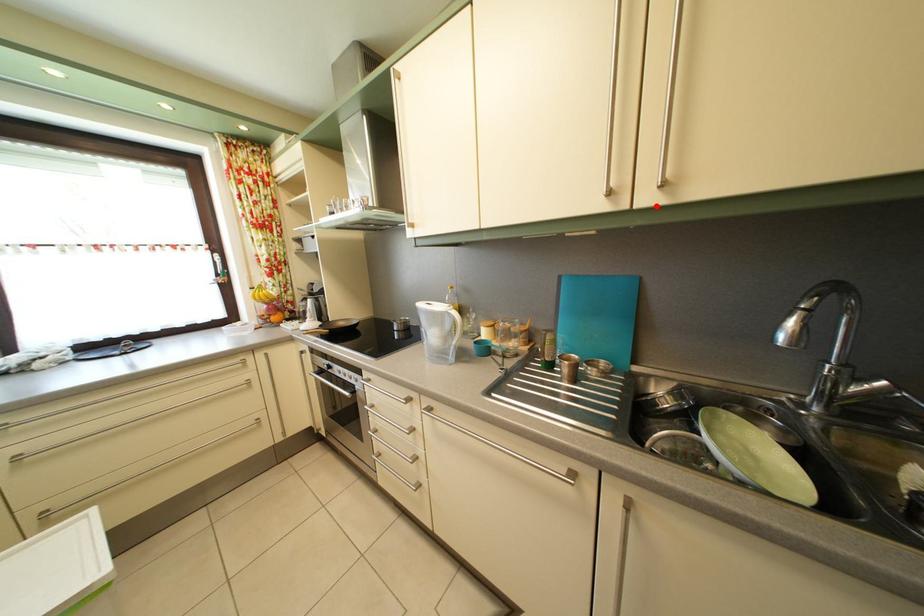
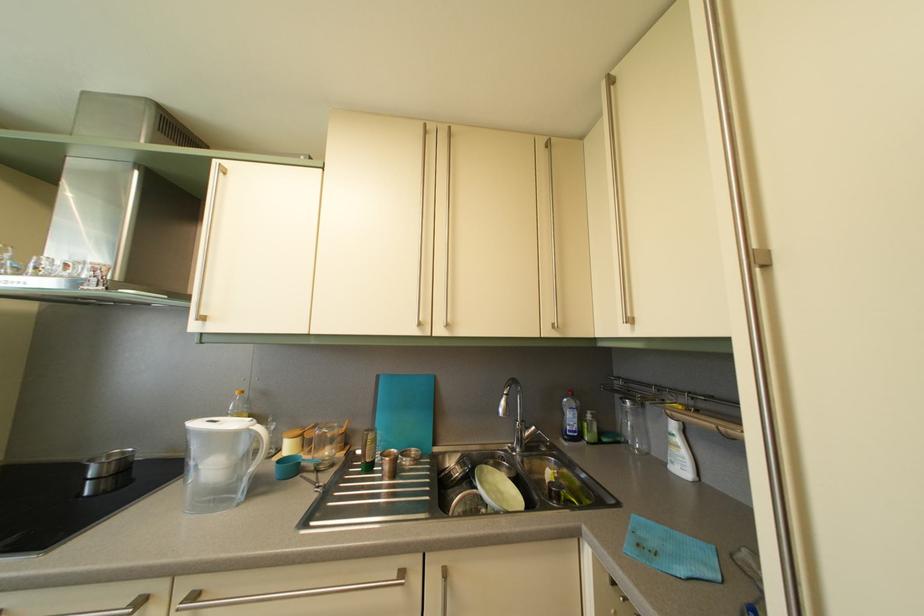
Locate, in the second image, the point that corresponds to the highlighted location in the first image.

(447, 339)